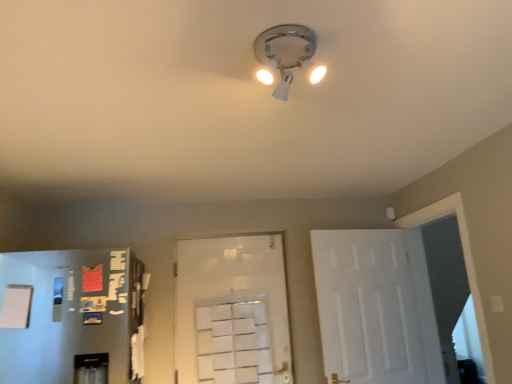
Question: Is matte white light fixture at center aimed at white matte door at right, the 2th door viewed from the left?

Choices:
 (A) no
 (B) yes

Answer: (A)

Question: Are matte white light fixture at center and white matte door at right, which ranks as the 1th door in right-to-left order, located far from each other?

Choices:
 (A) yes
 (B) no

Answer: (A)

Question: Is matte white light fixture at center in front of white matte door at right, which ranks as the 1th door in right-to-left order?

Choices:
 (A) no
 (B) yes

Answer: (B)

Question: Can you confirm if matte white light fixture at center is positioned to the right of white matte door at right, which ranks as the 1th door in right-to-left order?

Choices:
 (A) yes
 (B) no

Answer: (B)

Question: Is matte white light fixture at center turned away from white matte door at right, the 2th door viewed from the left?

Choices:
 (A) no
 (B) yes

Answer: (A)

Question: From the image's perspective, is white matte door at center, acting as the first door starting from the left, above or below matte white light fixture at center?

Choices:
 (A) below
 (B) above

Answer: (A)

Question: Considering the positions of white matte door at center, the second door positioned from the right, and matte white light fixture at center in the image, is white matte door at center, the second door positioned from the right, bigger or smaller than matte white light fixture at center?

Choices:
 (A) small
 (B) big

Answer: (B)

Question: From a real-world perspective, is white matte door at center, acting as the first door starting from the left, positioned above or below matte white light fixture at center?

Choices:
 (A) below
 (B) above

Answer: (A)

Question: In the image, is white matte door at center, the second door positioned from the right, positioned in front of or behind matte white light fixture at center?

Choices:
 (A) front
 (B) behind

Answer: (B)

Question: Would you say matte white light fixture at center is to the left or to the right of white matte door at right, the 2th door viewed from the left, in the picture?

Choices:
 (A) right
 (B) left

Answer: (B)

Question: In terms of width, does matte white light fixture at center look wider or thinner when compared to white matte door at right, the 2th door viewed from the left?

Choices:
 (A) thin
 (B) wide

Answer: (B)

Question: Is point (284, 79) positioned closer to the camera than point (404, 344)?

Choices:
 (A) closer
 (B) farther

Answer: (A)

Question: Is matte white light fixture at center in front of or behind white matte door at right, which ranks as the 1th door in right-to-left order, in the image?

Choices:
 (A) front
 (B) behind

Answer: (A)

Question: In terms of width, does matte white light fixture at center look wider or thinner when compared to white matte door at center, the second door positioned from the right?

Choices:
 (A) wide
 (B) thin

Answer: (A)

Question: Is point (297, 38) positioned closer to the camera than point (262, 266)?

Choices:
 (A) closer
 (B) farther

Answer: (A)